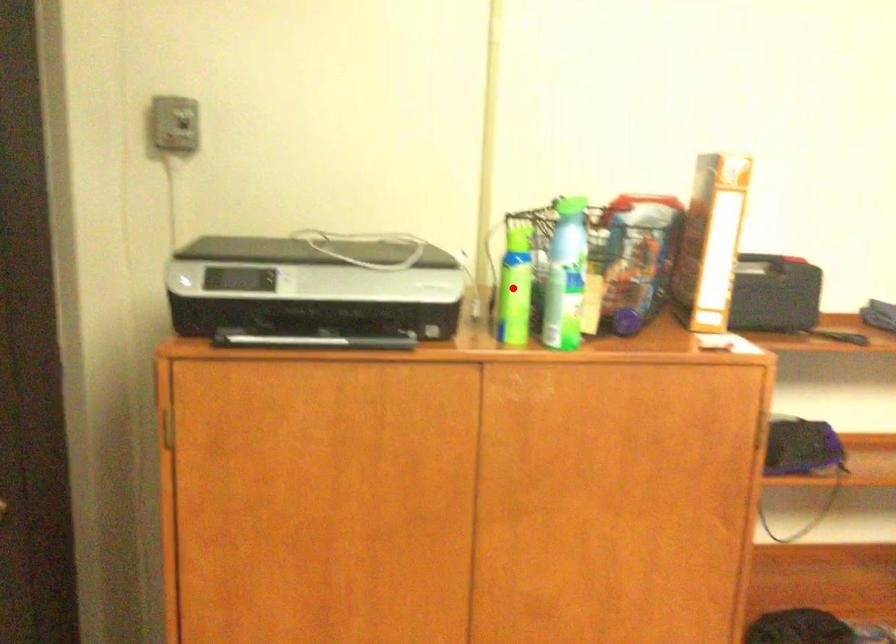
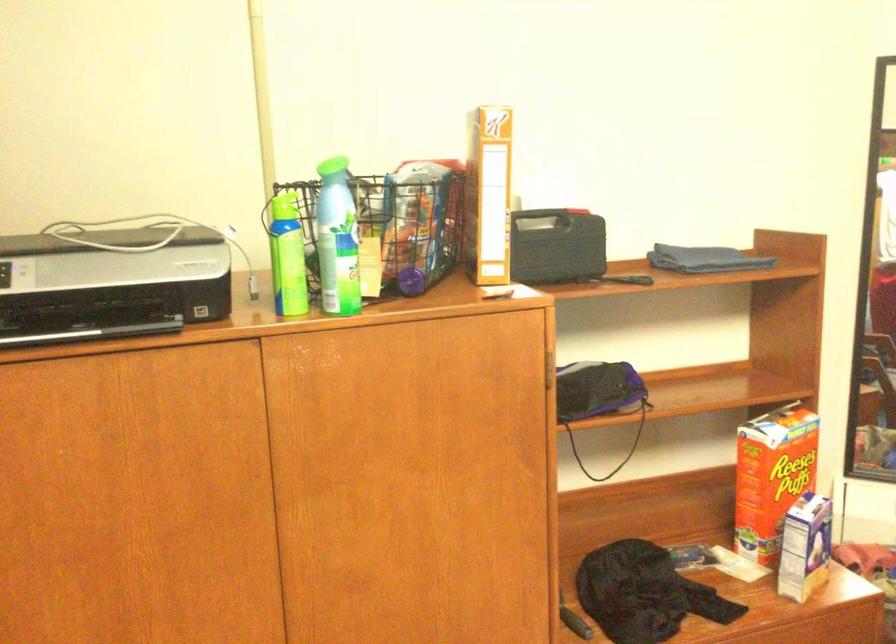
The point at the highlighted location is marked in the first image. Where is the corresponding point in the second image?

(288, 257)